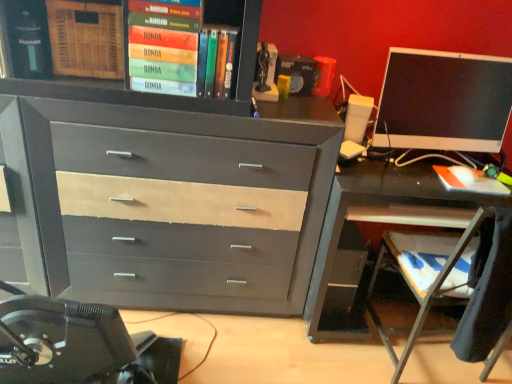
Question: Does hardcover book at upper center, acting as the second book starting from the top, come behind wooden at lower right?

Choices:
 (A) no
 (B) yes

Answer: (B)

Question: Could you tell me if hardcover book at upper center, which ranks as the 2th book in right-to-left order, is turned towards wooden at lower right?

Choices:
 (A) no
 (B) yes

Answer: (A)

Question: Considering the relative sizes of hardcover book at upper center, which ranks as the 2th book in right-to-left order, and wooden at lower right in the image provided, is hardcover book at upper center, which ranks as the 2th book in right-to-left order, smaller than wooden at lower right?

Choices:
 (A) yes
 (B) no

Answer: (A)

Question: Is hardcover book at upper center, arranged as the 2th book when viewed from the left, not inside wooden at lower right?

Choices:
 (A) no
 (B) yes

Answer: (B)

Question: Can you confirm if hardcover book at upper center, arranged as the 2th book when viewed from the left, is bigger than wooden at lower right?

Choices:
 (A) no
 (B) yes

Answer: (A)

Question: Is hardcover book at upper center, arranged as the 2th book when viewed from the left, facing away from wooden at lower right?

Choices:
 (A) yes
 (B) no

Answer: (B)

Question: Is matte gray wood chest of drawers at center in contact with wooden at lower right?

Choices:
 (A) no
 (B) yes

Answer: (A)

Question: Is matte gray wood chest of drawers at center facing towards wooden at lower right?

Choices:
 (A) no
 (B) yes

Answer: (A)

Question: Is matte gray wood chest of drawers at center wider than wooden at lower right?

Choices:
 (A) no
 (B) yes

Answer: (A)

Question: Considering the relative sizes of matte gray wood chest of drawers at center and wooden at lower right in the image provided, is matte gray wood chest of drawers at center taller than wooden at lower right?

Choices:
 (A) yes
 (B) no

Answer: (A)

Question: Can you confirm if matte gray wood chest of drawers at center is smaller than wooden at lower right?

Choices:
 (A) no
 (B) yes

Answer: (A)

Question: Is there a large distance between matte gray wood chest of drawers at center and wooden at lower right?

Choices:
 (A) no
 (B) yes

Answer: (A)

Question: Is matte gray wood chest of drawers at center closer to camera compared to metallic gray desk at right?

Choices:
 (A) no
 (B) yes

Answer: (B)